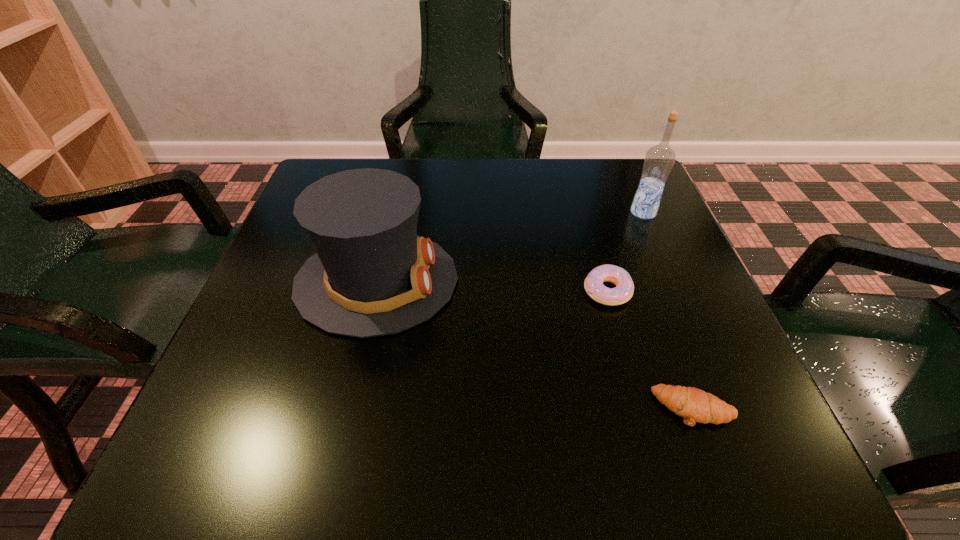
You are a GUI agent. You are given a task and a screenshot of the screen. Output one action in this format:
    pyautogui.click(x=<x>, y=<y>)
    Task: Click on the vacant space that satisfies the following two spatial constraints: 1. on the back side of the doughnut; 2. on the left side of the farthest object
    Image resolution: width=960 pixels, height=540 pixels.
    Given the screenshot: What is the action you would take?
    pyautogui.click(x=586, y=212)

You are a GUI agent. You are given a task and a screenshot of the screen. Output one action in this format:
    pyautogui.click(x=<x>, y=<y>)
    Task: Click on the free space that satisfies the following two spatial constraints: 1. on the back side of the vodka; 2. on the left side of the doughnut
    The image size is (960, 540).
    Given the screenshot: What is the action you would take?
    pyautogui.click(x=586, y=212)